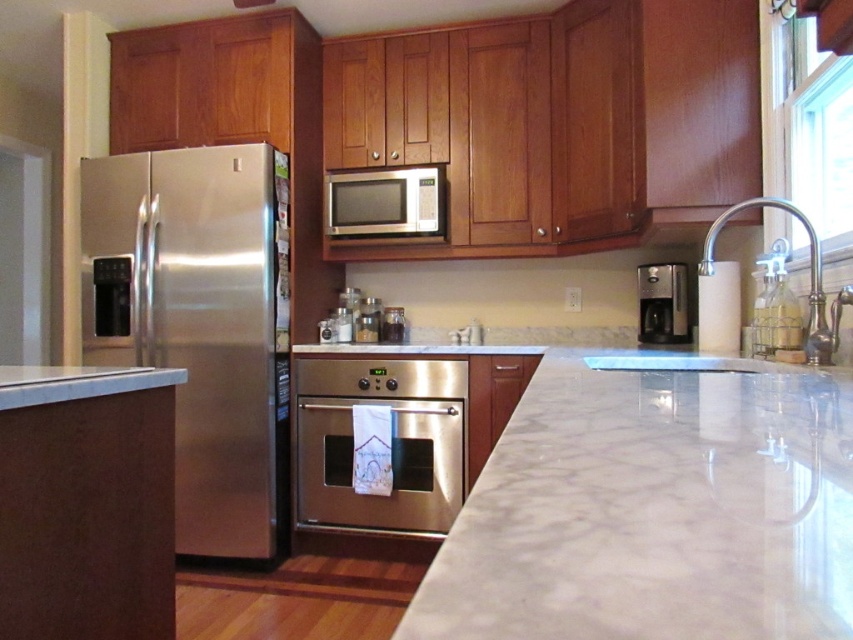
Question: Which object is the farthest from the satin silver microwave at upper center?

Choices:
 (A) matte glass jar at center
 (B) stainless steel oven at center
 (C) stainless steel refrigerator at left
 (D) satin metallic coffee maker at right

Answer: (D)

Question: Does satin silver microwave at upper center appear on the right side of satin metallic canisters at center?

Choices:
 (A) yes
 (B) no

Answer: (A)

Question: Which is farther from the satin metallic coffee maker at right?

Choices:
 (A) white marble countertop at lower left
 (B) satin metallic canisters at center
 (C) stainless steel oven at center
 (D) satin silver microwave at upper center

Answer: (A)

Question: Which object appears closest to the camera in this image?

Choices:
 (A) matte glass jar at center
 (B) white marble countertop at center
 (C) white marble countertop at lower left
 (D) stainless steel oven at center

Answer: (B)

Question: Does satin metallic coffee maker at right have a lesser width compared to satin metallic canisters at center?

Choices:
 (A) yes
 (B) no

Answer: (B)

Question: Can you confirm if stainless steel refrigerator at left is wider than stainless steel oven at center?

Choices:
 (A) yes
 (B) no

Answer: (A)